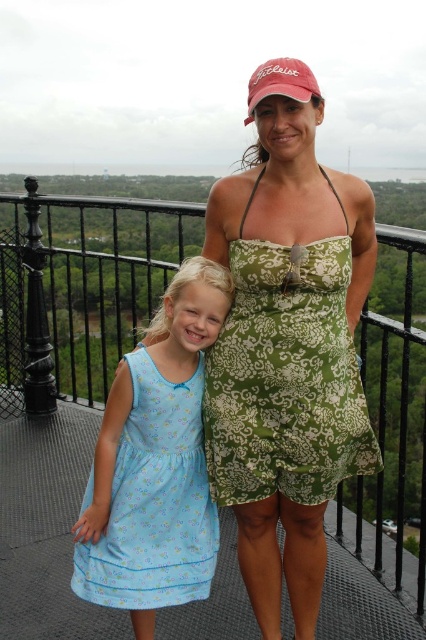
You are a photographer positioned below the balcony. You want to take a photo of the light blue fabric dress at left without including the black metal railing at upper center in the frame. Is this possible given their positions?

The black metal railing at upper center is above the light blue fabric dress at left, so if you position yourself below and aim upwards, you can capture the light blue fabric dress at left while excluding the railing by adjusting the camera angle appropriately.

You are a photographer trying to capture a clear shot of both the light blue fabric dress at left and the black metal railing at upper center. Based on their positions, which object is closer to the camera?

The black metal railing at upper center is closer to the camera because the light blue fabric dress at left is behind it.

You are a photographer positioned at the camera. You want to capture a closeup shot of the green printed dress at center. Given that your camera has a minimum focusing distance of 2 meters, will you be able to take the photo without moving closer?

The distance between the green printed dress at center and the camera is 5.56 meters, which is greater than the minimum focusing distance of 2 meters. Therefore, you can take the closeup shot without needing to move closer.